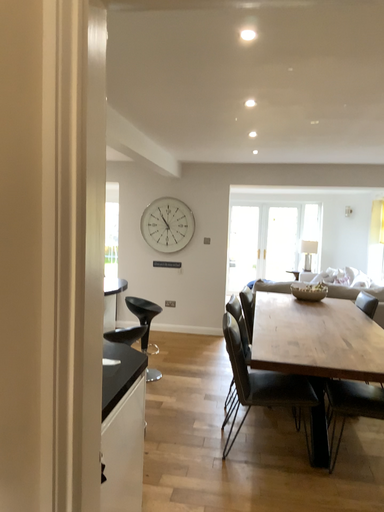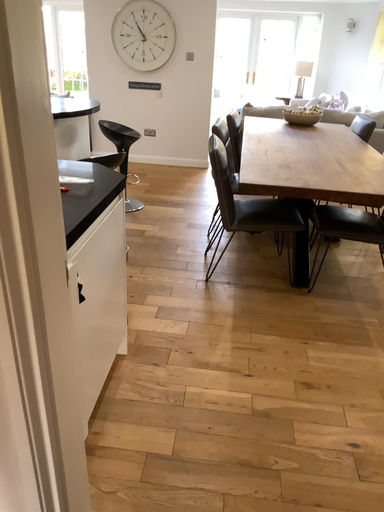
Question: Which way did the camera rotate in the video?

Choices:
 (A) rotated downward
 (B) rotated upward

Answer: (A)